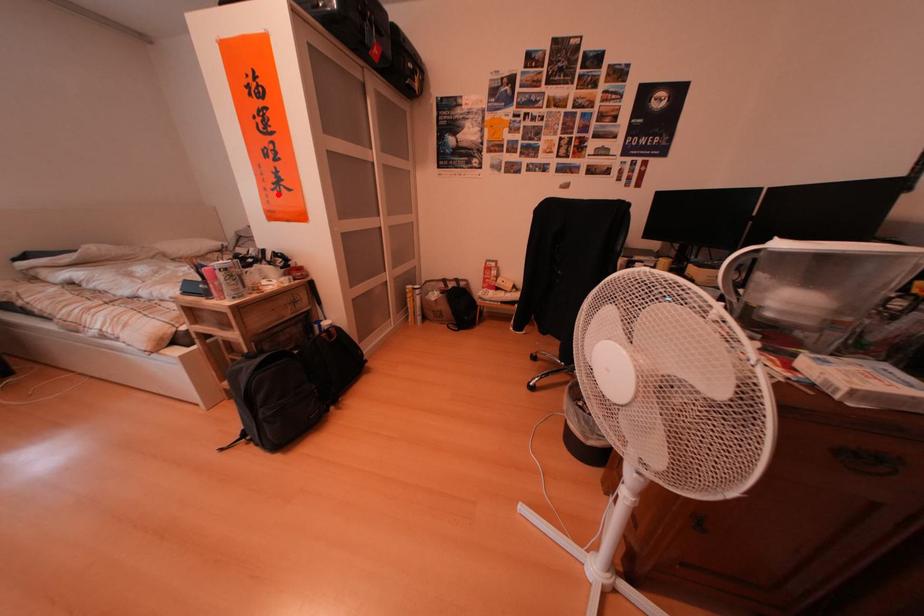
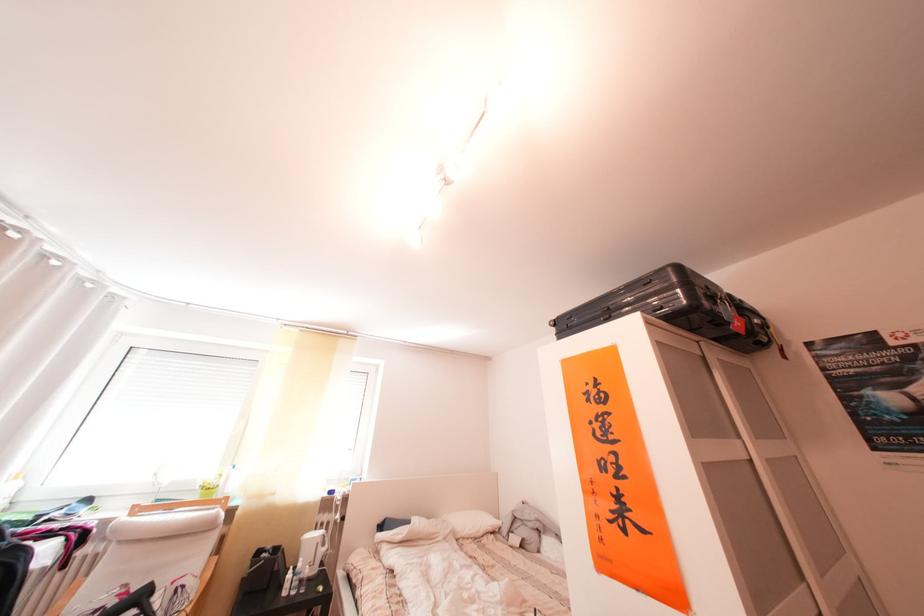
Question: I am providing you with two images of the same scene from different viewpoints. A red point is shown in image1. For the corresponding object point in image2, is it positioned nearer or farther from the camera?

Choices:
 (A) Nearer
 (B) Farther

Answer: (B)